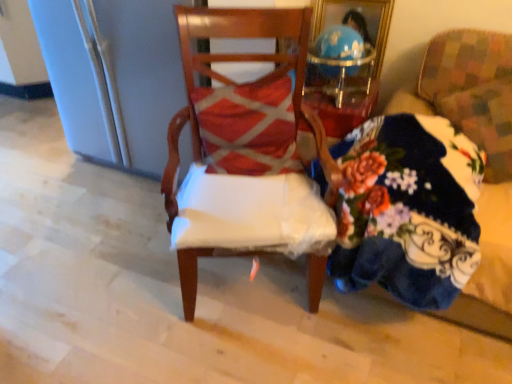
Question: In the image, is floral-patterned fabric at right, which is the second chair from left to right, positioned in front of or behind wooden chair at center, the first chair from the left?

Choices:
 (A) front
 (B) behind

Answer: (B)

Question: Considering the positions of point (478, 87) and point (314, 225), is point (478, 87) closer or farther from the camera than point (314, 225)?

Choices:
 (A) farther
 (B) closer

Answer: (A)

Question: Based on their relative distances, which object is farther from the floral-patterned fabric at right, the first chair when ordered from right to left?

Choices:
 (A) textured red pillow at center
 (B) floral fabric couch at right
 (C) wooden chair at center, the second chair from the right

Answer: (C)

Question: Estimate the real-world distances between objects in this image. Which object is closer to the wooden chair at center, the second chair from the right?

Choices:
 (A) floral-patterned fabric at right, the first chair when ordered from right to left
 (B) floral fabric couch at right
 (C) textured red pillow at center

Answer: (C)